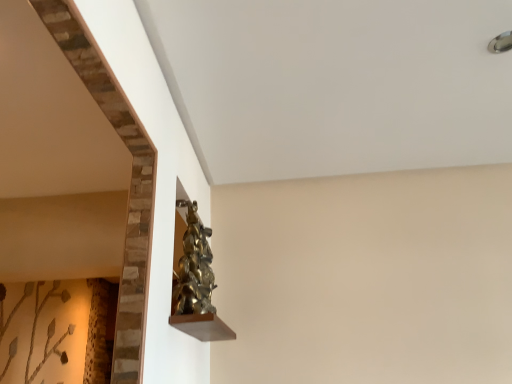
Image resolution: width=512 pixels, height=384 pixels. What do you see at coordinates (194, 268) in the screenshot?
I see `gold metallic statue at center` at bounding box center [194, 268].

Locate an element on the screen. Image resolution: width=512 pixels, height=384 pixels. gold metallic statue at center is located at coordinates (194, 268).

In order to click on gold metallic statue at center in this screenshot , I will do `click(194, 268)`.